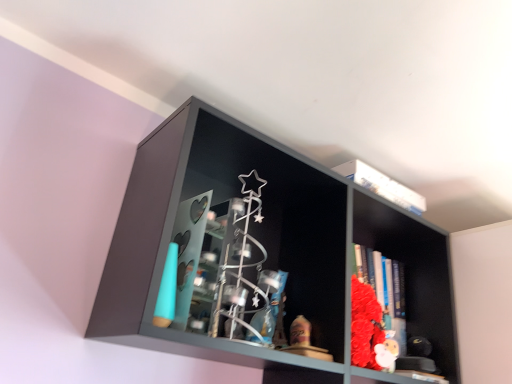
Question: Considering the positions of matte black shelf at center and white plush toy at lower right in the image, is matte black shelf at center taller or shorter than white plush toy at lower right?

Choices:
 (A) tall
 (B) short

Answer: (A)

Question: Based on their positions, is matte black shelf at center located to the left or right of white plush toy at lower right?

Choices:
 (A) right
 (B) left

Answer: (B)

Question: Looking at their shapes, would you say matte black shelf at center is wider or thinner than white plush toy at lower right?

Choices:
 (A) wide
 (B) thin

Answer: (A)

Question: Based on their sizes in the image, would you say white plush toy at lower right is bigger or smaller than matte black shelf at center?

Choices:
 (A) big
 (B) small

Answer: (B)

Question: Is point (379, 347) positioned closer to the camera than point (324, 314)?

Choices:
 (A) closer
 (B) farther

Answer: (B)

Question: In terms of width, does white plush toy at lower right look wider or thinner when compared to matte black shelf at center?

Choices:
 (A) thin
 (B) wide

Answer: (A)

Question: From a real-world perspective, relative to matte black shelf at center, is white plush toy at lower right vertically above or below?

Choices:
 (A) below
 (B) above

Answer: (A)